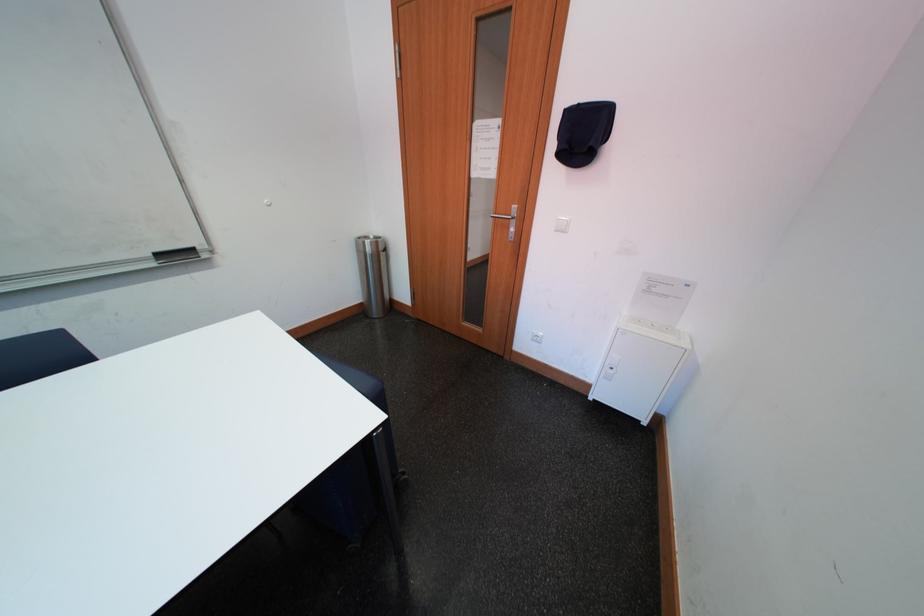
Describe the element at coordinates (562, 224) in the screenshot. Image resolution: width=924 pixels, height=616 pixels. I see `a light switch button` at that location.